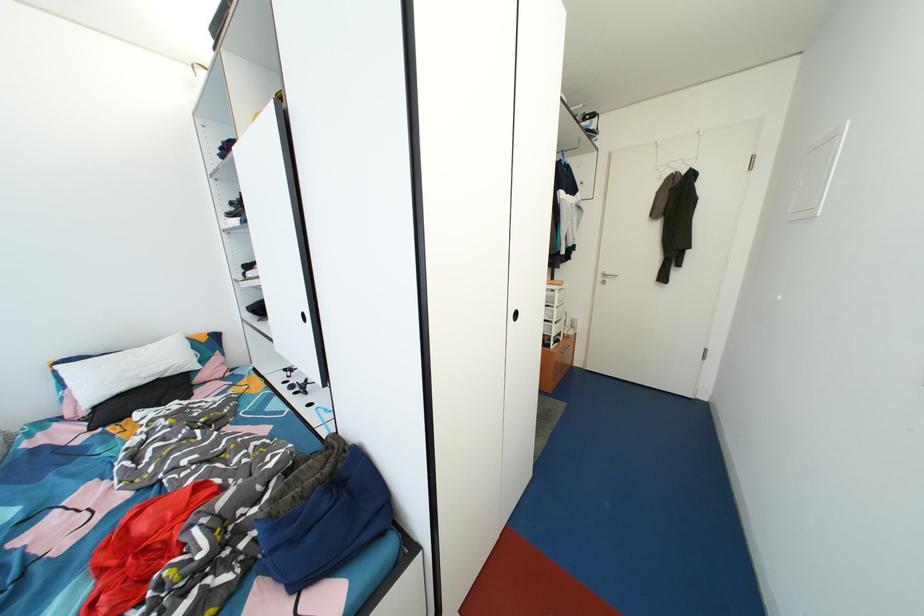
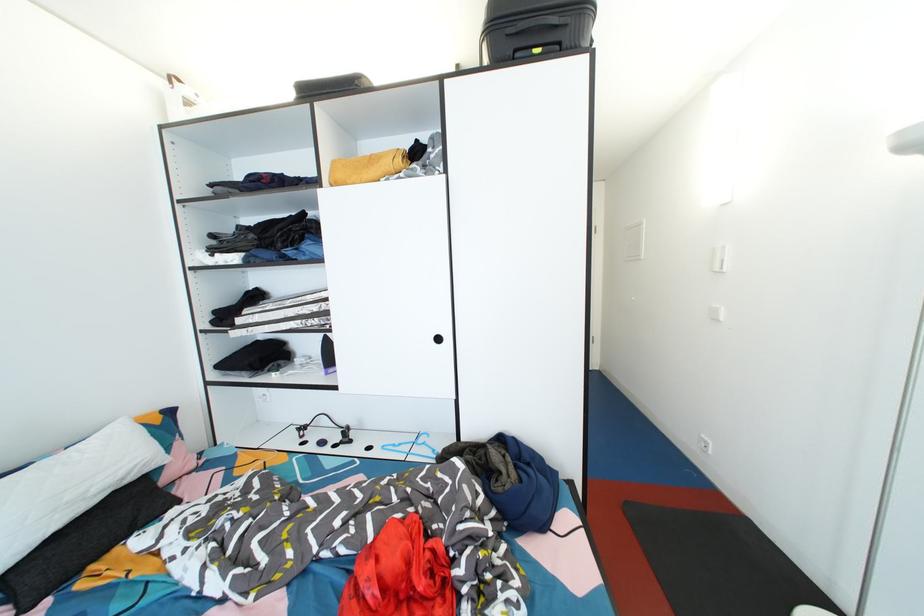
In the second image, find the point that corresponds to point 167,373 in the first image.

(128, 477)